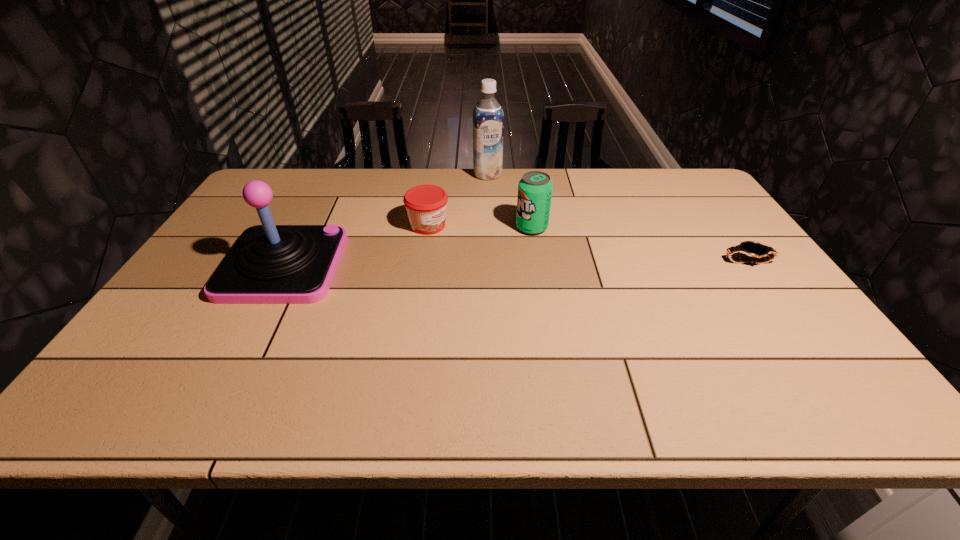
Locate an element on the screen. free space on the desktop that is between the joystick and the rightmost object and is positioned on the front-facing side of the third tallest object is located at coordinates (452, 264).

Where is `vacant spot on the desktop that is between the joystick and the rightmost object and is positioned on the label of the farthest object`? vacant spot on the desktop that is between the joystick and the rightmost object and is positioned on the label of the farthest object is located at coordinates (518, 264).

What are the coordinates of `vacant spot on the desktop that is between the leftmost object and the watch and is positioned on the label side of the second object from left to right` in the screenshot? It's located at (513, 264).